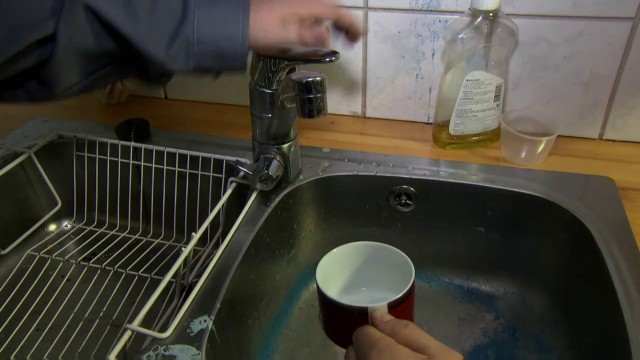
Where is `rack`? This screenshot has height=360, width=640. rack is located at coordinates (107, 303).